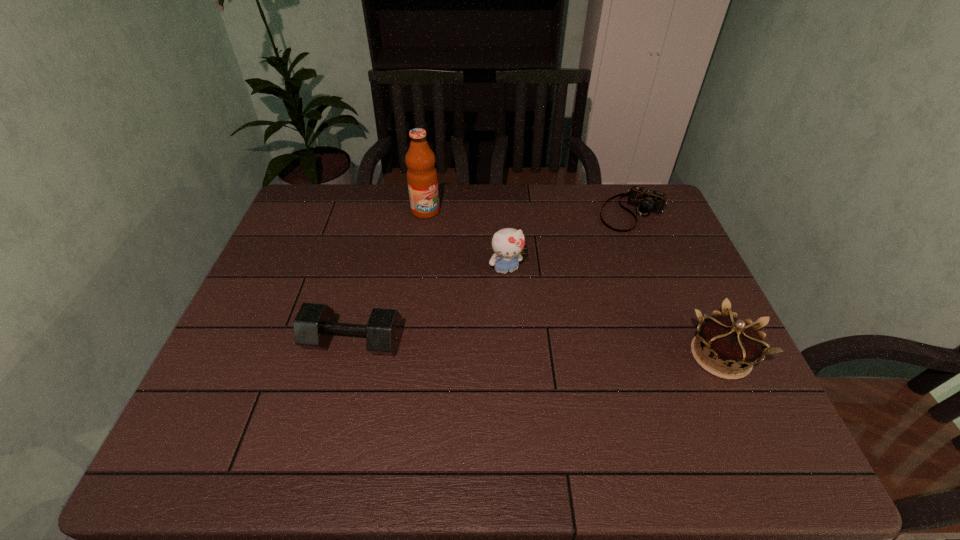
Where is `the closest object to the tallest object`? The image size is (960, 540). the closest object to the tallest object is located at coordinates (508, 243).